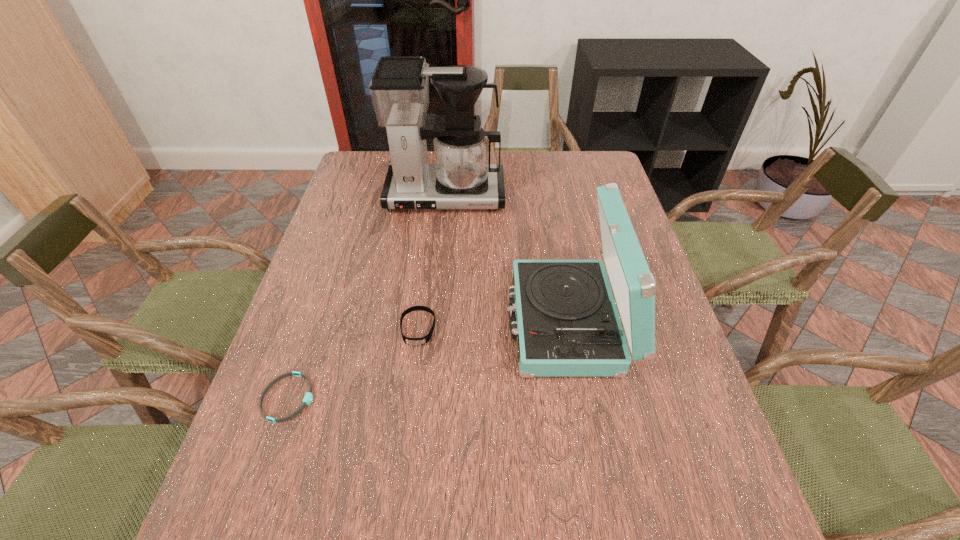
This screenshot has height=540, width=960. In order to click on the farthest object in this screenshot , I will do `click(462, 177)`.

Locate an element on the screen. The height and width of the screenshot is (540, 960). coffee maker is located at coordinates (462, 177).

What are the coordinates of `the third shortest object` in the screenshot? It's located at (565, 318).

The width and height of the screenshot is (960, 540). Identify the location of the third tallest object. (411, 341).

Identify the location of the farther wristband. (411, 341).

You are a GUI agent. You are given a task and a screenshot of the screen. Output one action in this format:
    pyautogui.click(x=<x>, y=<y>)
    Task: Click on the leftmost object
    
    Given the screenshot: What is the action you would take?
    pyautogui.click(x=308, y=397)

The image size is (960, 540). I want to click on the nearer wristband, so click(308, 397).

Identify the location of free space located at the front of the farthest object where the controls are located. This screenshot has height=540, width=960. (438, 269).

Image resolution: width=960 pixels, height=540 pixels. I want to click on vacant space located on the face side of the record player, so click(x=424, y=322).

Locate an element on the screen. free spot located 0.220m on the face side of the record player is located at coordinates (416, 322).